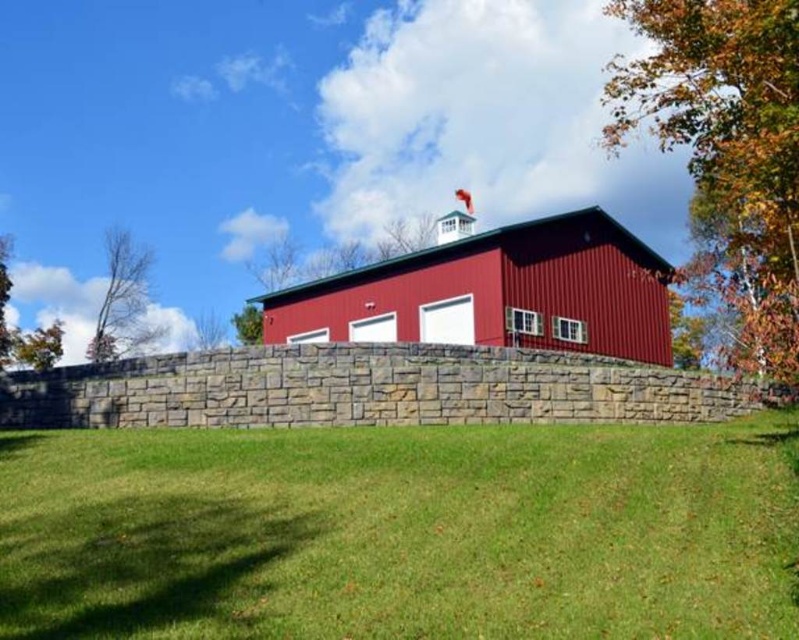
Question: Which object appears farthest from the camera in this image?

Choices:
 (A) green leafy tree at lower left
 (B) gray stone wall at center
 (C) green grass at center
 (D) metallic red barn at center

Answer: (A)

Question: Which of the following is the closest to the observer?

Choices:
 (A) autumn leaves at upper right
 (B) bare branches at left
 (C) green leafy tree at lower left
 (D) metallic red barn at center

Answer: (A)

Question: Is bare branches at left to the right of green leafy tree at lower left from the viewer's perspective?

Choices:
 (A) no
 (B) yes

Answer: (A)

Question: Which point is closer to the camera taking this photo?

Choices:
 (A) (244, 304)
 (B) (478, 300)

Answer: (B)

Question: Is autumn leaves at upper right to the right of metallic red barn at center from the viewer's perspective?

Choices:
 (A) no
 (B) yes

Answer: (B)

Question: Is gray stone wall at center thinner than metallic red barn at center?

Choices:
 (A) yes
 (B) no

Answer: (B)